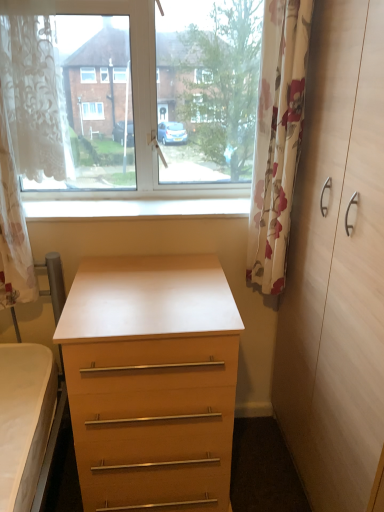
The image size is (384, 512). Identify the location of vacant area on top of white smooth window sill at center (from a real-world perspective). (147, 207).